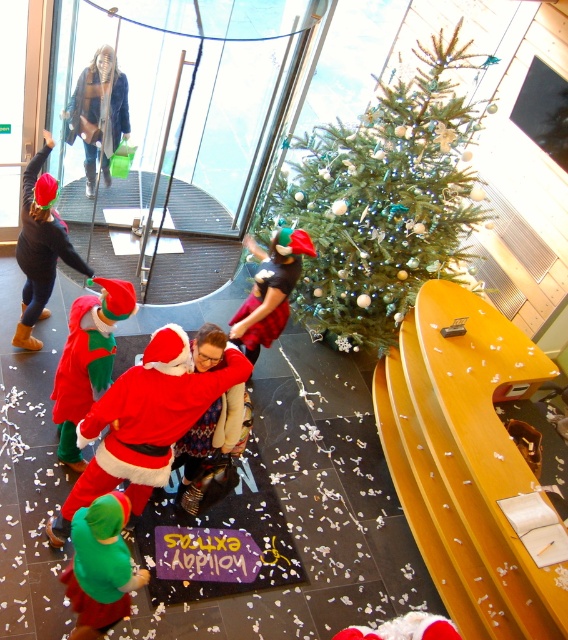
You are organizing a photo shoot in this festive indoor scene and need to position two black items for a closeup. The items are the matte black outfit at left and the matte black jacket at upper left. Based on their sizes, which item would you choose to place closer to the camera to ensure it appears larger in the photo?

The matte black outfit at left is much taller than the matte black jacket at upper left, so placing the matte black outfit at left closer to the camera would make it appear larger in the photo.

You are standing in the room and want to take a photo of the green matte christmas tree at center without the matte black outfit at left appearing in the frame. Is this possible based on their positions?

The green matte christmas tree at center is located above the matte black outfit at left, so if you position yourself to aim the camera upwards towards the tree while ensuring the lower area where the matte black outfit at left is positioned is out of the frame, it should be possible to capture the tree without the outfit appearing in the shot.

You are a photographer standing in the room and want to take a picture of the green matte christmas tree at center and the matte black jacket at upper left. Which object is taller?

The green matte christmas tree at center is taller than the matte black jacket at upper left.